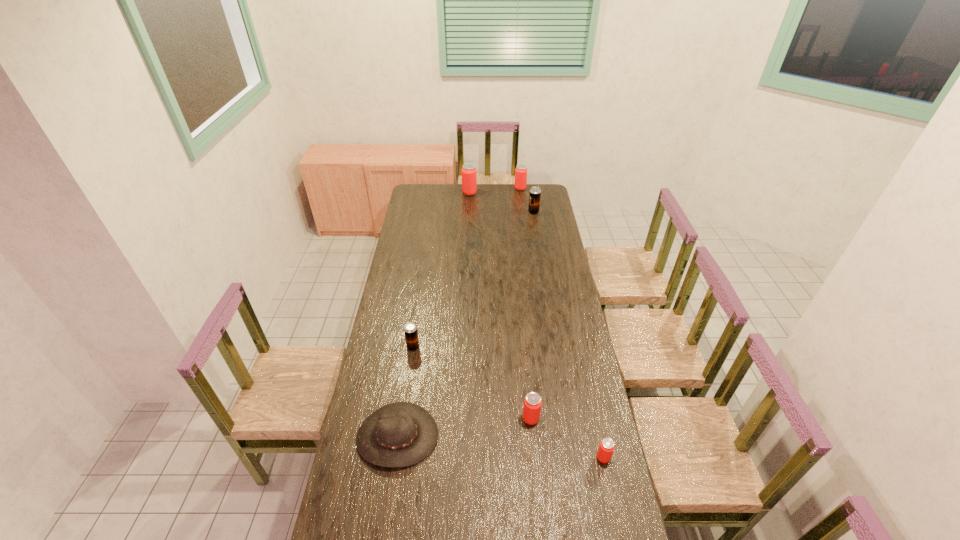
Where is `vacant area between the third smallest red beer can and the nearer black beer can`? This screenshot has height=540, width=960. vacant area between the third smallest red beer can and the nearer black beer can is located at coordinates (467, 268).

At what (x,y) coordinates should I click in order to perform the action: click on vacant area that lies between the shortest beer can and the hat. Please return your answer as a coordinate pair (x, y). Image resolution: width=960 pixels, height=540 pixels. Looking at the image, I should click on (500, 447).

Choose which object is the nearest neighbor to the hat. Please provide its 2D coordinates. Your answer should be formatted as a tuple, i.e. [(x, y)], where the tuple contains the x and y coordinates of a point satisfying the conditions above.

[(411, 335)]

You are a GUI agent. You are given a task and a screenshot of the screen. Output one action in this format:
    pyautogui.click(x=<x>, y=<y>)
    Task: Click on the object that can be found as the closest to the hat
    The height and width of the screenshot is (540, 960).
    Given the screenshot: What is the action you would take?
    pyautogui.click(x=411, y=335)

Identify which beer can is located as the third nearest to the third smallest red beer can. Please provide its 2D coordinates. Your answer should be formatted as a tuple, i.e. [(x, y)], where the tuple contains the x and y coordinates of a point satisfying the conditions above.

[(411, 335)]

The image size is (960, 540). I want to click on beer can that stands as the closest to the fifth beer can from right to left, so click(521, 170).

Select which red beer can is the third closest to the leftmost beer can. Please provide its 2D coordinates. Your answer should be formatted as a tuple, i.e. [(x, y)], where the tuple contains the x and y coordinates of a point satisfying the conditions above.

[(469, 172)]

I want to click on the closest red beer can to the fourth beer can from right to left, so click(x=606, y=447).

Locate which black beer can ranks in proximity to the leftmost red beer can. Please provide its 2D coordinates. Your answer should be formatted as a tuple, i.e. [(x, y)], where the tuple contains the x and y coordinates of a point satisfying the conditions above.

[(535, 193)]

Locate which black beer can is the closest to the hat. Please provide its 2D coordinates. Your answer should be formatted as a tuple, i.e. [(x, y)], where the tuple contains the x and y coordinates of a point satisfying the conditions above.

[(411, 335)]